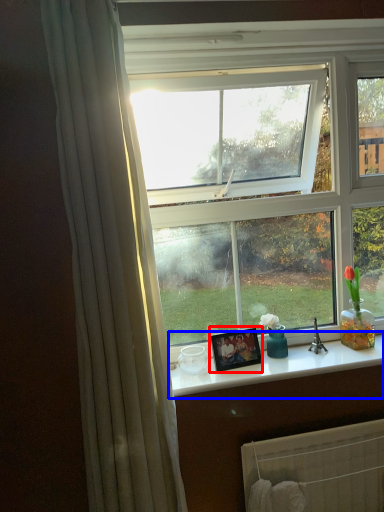
Question: Which object appears closest to the camera in this image, picture frame (highlighted by a red box) or counter top (highlighted by a blue box)?

Choices:
 (A) picture frame
 (B) counter top

Answer: (B)